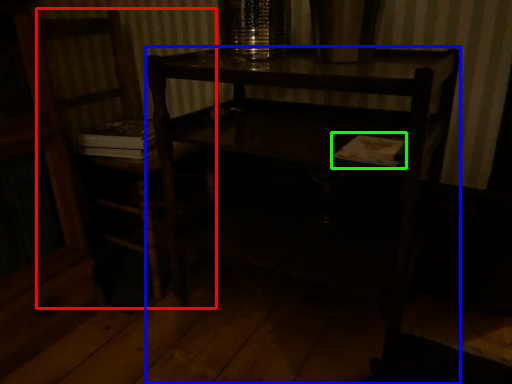
Question: Considering the real-world distances, which object is closest to chair (highlighted by a red box)? desk (highlighted by a blue box) or book (highlighted by a green box).

Choices:
 (A) desk
 (B) book

Answer: (A)